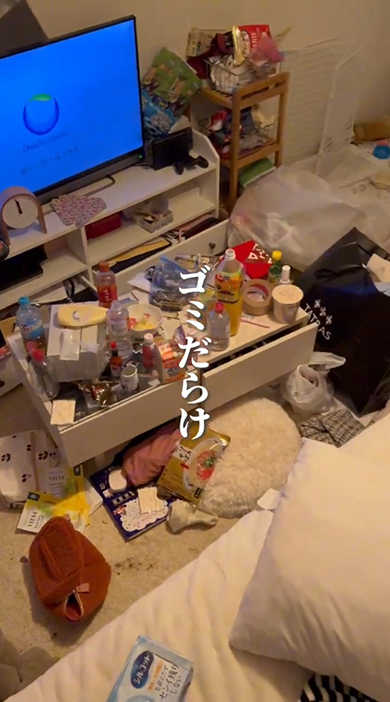
In order to click on shelf in this screenshot , I will do `click(259, 97)`, `click(261, 152)`, `click(217, 97)`.